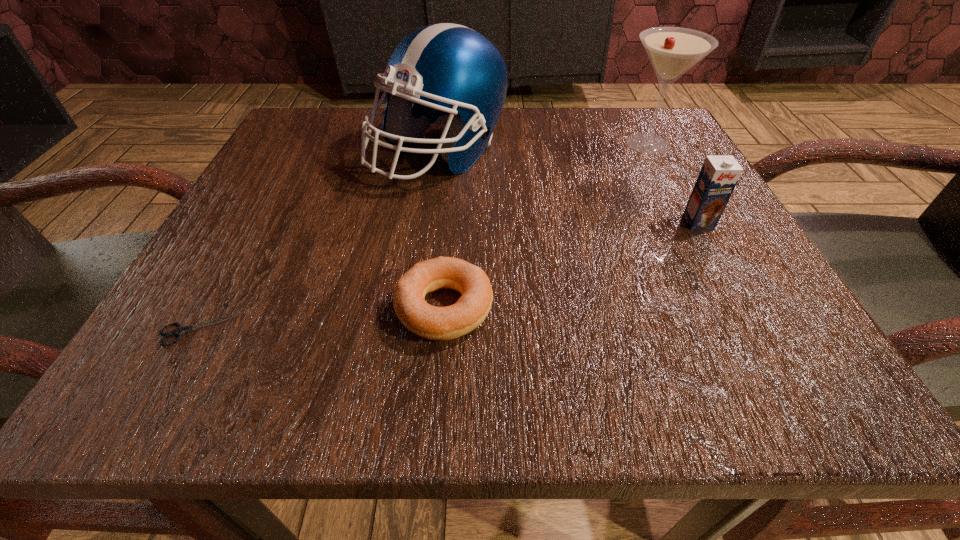
Locate an element on the screen. The width and height of the screenshot is (960, 540). vacant area that lies between the football helmet and the martini is located at coordinates (543, 148).

At what (x,y) coordinates should I click in order to perform the action: click on free point between the football helmet and the shears. Please return your answer as a coordinate pair (x, y). This screenshot has height=540, width=960. Looking at the image, I should click on (320, 241).

Image resolution: width=960 pixels, height=540 pixels. In order to click on free point between the martini and the shortest object in this screenshot , I will do `click(424, 236)`.

Locate an element on the screen. Image resolution: width=960 pixels, height=540 pixels. free area in between the third shortest object and the football helmet is located at coordinates (568, 187).

Where is `vacant point located between the football helmet and the martini`? This screenshot has width=960, height=540. vacant point located between the football helmet and the martini is located at coordinates click(x=543, y=148).

Identify the location of free space that is in between the shortest object and the football helmet. (320, 241).

At what (x,y) coordinates should I click in order to perform the action: click on the third closest object to the bagel. Please return your answer as a coordinate pair (x, y). Looking at the image, I should click on (719, 175).

Image resolution: width=960 pixels, height=540 pixels. Identify the location of the second closest object to the leftmost object. (452, 75).

Identify the location of free spot that satisfies the following two spatial constraints: 1. on the back side of the bagel; 2. on the left side of the martini. The image size is (960, 540). (456, 144).

Find the location of `vacant area in the image that satisfies the following two spatial constraints: 1. at the front of the football helmet with the faceguard; 2. on the left side of the fourth tallest object`. vacant area in the image that satisfies the following two spatial constraints: 1. at the front of the football helmet with the faceguard; 2. on the left side of the fourth tallest object is located at coordinates (419, 308).